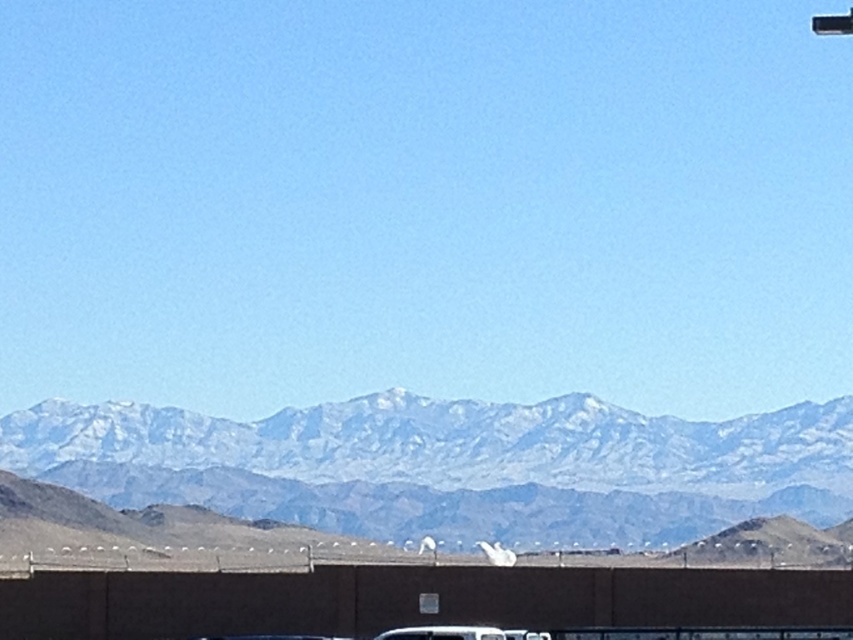
Is brown concrete overpass at lower center thinner than white matte car at lower center?

In fact, brown concrete overpass at lower center might be wider than white matte car at lower center.

The image size is (853, 640). Describe the element at coordinates (410, 600) in the screenshot. I see `brown concrete overpass at lower center` at that location.

At what (x,y) coordinates should I click in order to perform the action: click on brown concrete overpass at lower center. Please return your answer as a coordinate pair (x, y). The height and width of the screenshot is (640, 853). Looking at the image, I should click on (x=410, y=600).

Is snowy rocky mountain range at center to the right of brown concrete overpass at lower center from the viewer's perspective?

Incorrect, snowy rocky mountain range at center is not on the right side of brown concrete overpass at lower center.

Locate an element on the screen. snowy rocky mountain range at center is located at coordinates (451, 465).

The image size is (853, 640). I want to click on snowy rocky mountain range at center, so click(x=451, y=465).

Can you confirm if snowy rocky mountain range at center is taller than white matte car at lower center?

Yes, snowy rocky mountain range at center is taller than white matte car at lower center.

Between point (142, 476) and point (457, 637), which one is positioned in front?

Point (457, 637) is in front.

Does point (279, 433) lie in front of point (451, 636)?

No, it is not.

This screenshot has width=853, height=640. I want to click on snowy rocky mountain range at center, so click(x=451, y=465).